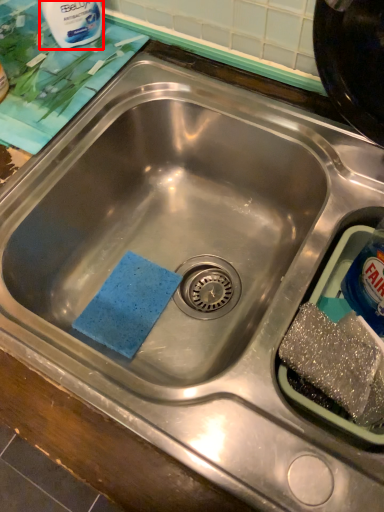
Question: From the image's perspective, where is cleaning product (annotated by the red box) located relative to bottle?

Choices:
 (A) below
 (B) above

Answer: (B)